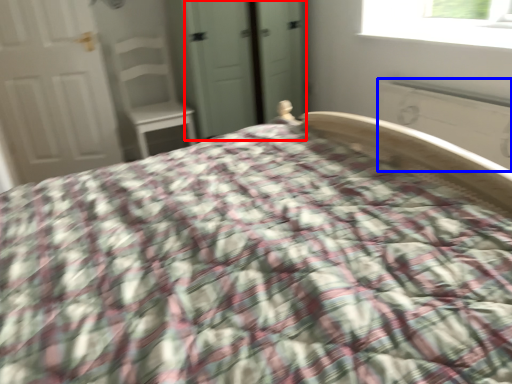
Question: Which of the following is the farthest to the observer, screen door (highlighted by a red box) or radiator (highlighted by a blue box)?

Choices:
 (A) screen door
 (B) radiator

Answer: (A)